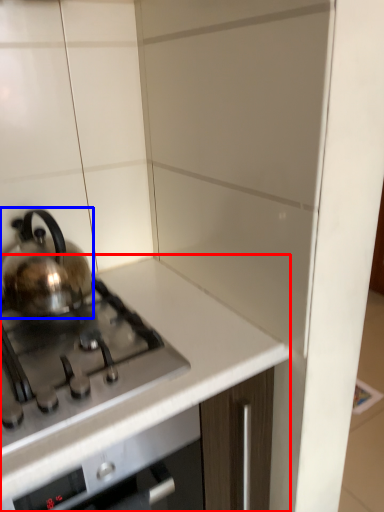
Question: Which point is further to the camera, countertop (highlighted by a red box) or kettle (highlighted by a blue box)?

Choices:
 (A) countertop
 (B) kettle

Answer: (B)